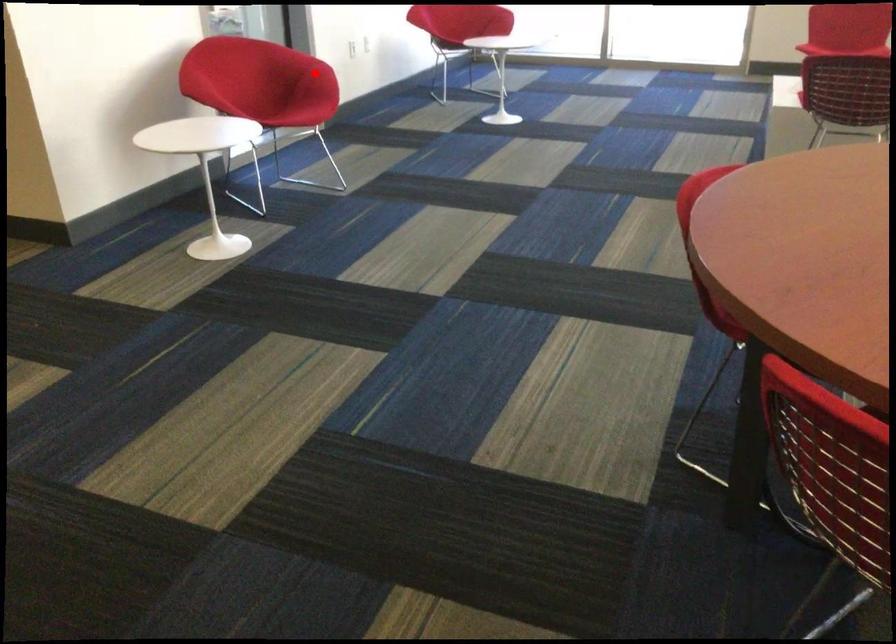
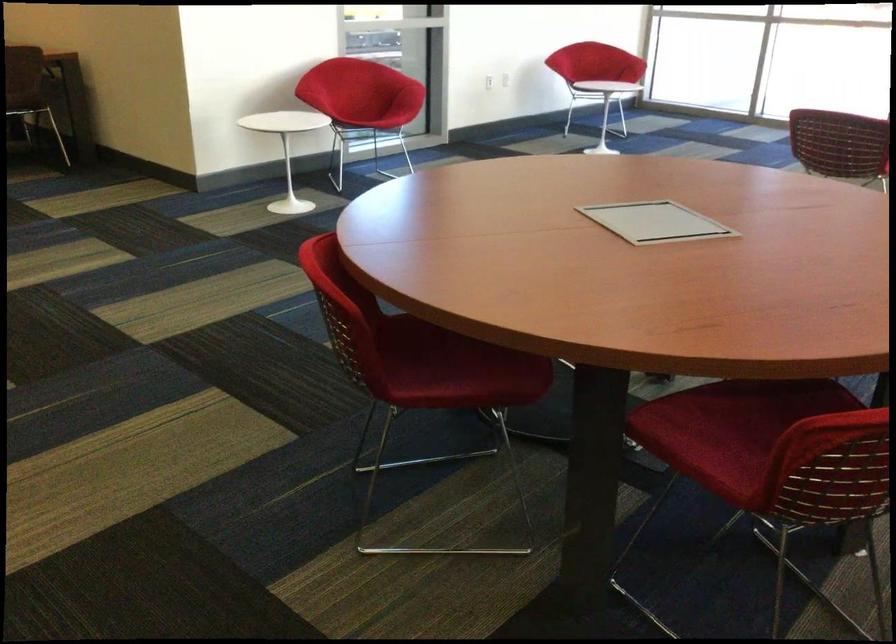
Question: I am providing you with two images of the same scene from different viewpoints. Image1 has a red point marked. In image2, the corresponding 3D location appears at what relative position? Reply with the corresponding letter.

Choices:
 (A) Closer
 (B) Farther

Answer: (B)